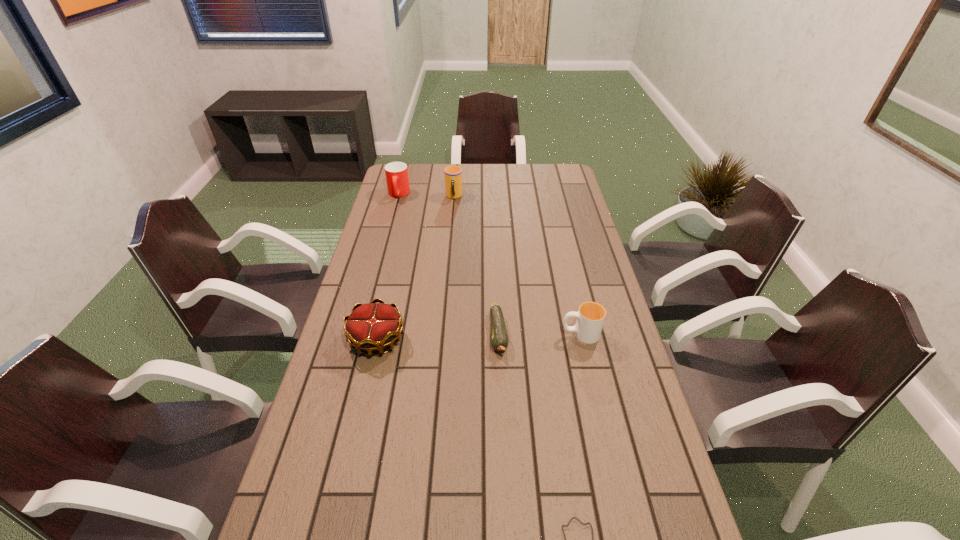
This screenshot has width=960, height=540. What are the coordinates of `the second cup from left to right` in the screenshot? It's located at (453, 174).

I want to click on the leftmost cup, so click(x=397, y=179).

Identify the location of the rightmost cup. Image resolution: width=960 pixels, height=540 pixels. (590, 318).

This screenshot has height=540, width=960. I want to click on the shortest cup, so click(590, 318).

In order to click on crown in this screenshot , I will do `click(370, 327)`.

What are the coordinates of `zucchini` in the screenshot? It's located at (499, 340).

Locate an element on the screen. The width and height of the screenshot is (960, 540). vacant space positioned 0.310m on the side of the third object from left to right with the handle is located at coordinates (449, 248).

Locate an element on the screen. vacant area situated 0.300m on the side of the leftmost cup with the handle is located at coordinates (385, 245).

You are a GUI agent. You are given a task and a screenshot of the screen. Output one action in this format:
    pyautogui.click(x=<x>, y=<y>)
    Task: Click on the vacant space located 0.160m with the handle on the side of the rightmost cup
    The image size is (960, 540).
    Given the screenshot: What is the action you would take?
    pyautogui.click(x=507, y=334)

Where is `free space located 0.330m with the handle on the side of the rightmost cup`? The width and height of the screenshot is (960, 540). free space located 0.330m with the handle on the side of the rightmost cup is located at coordinates (449, 334).